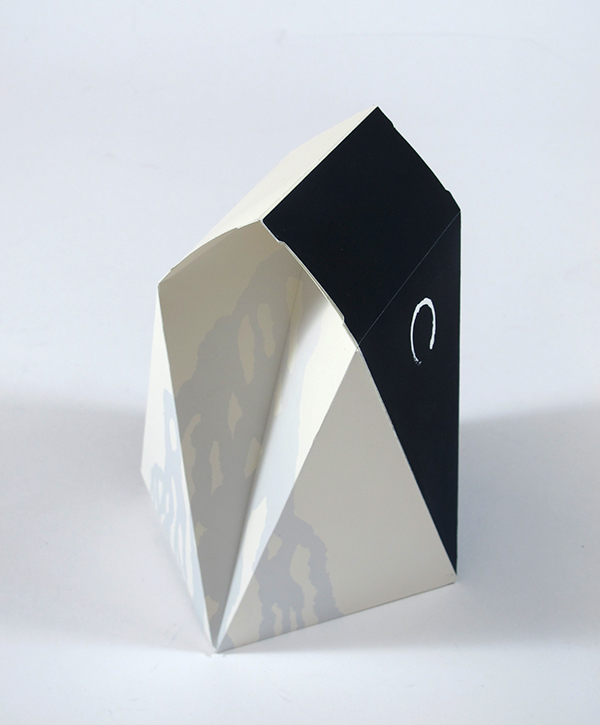
At what (x,y) coordinates should I click in order to perform the action: click on white tabletop. Please return your answer as a coordinate pair (x, y). The height and width of the screenshot is (725, 600). Looking at the image, I should click on (402, 689).